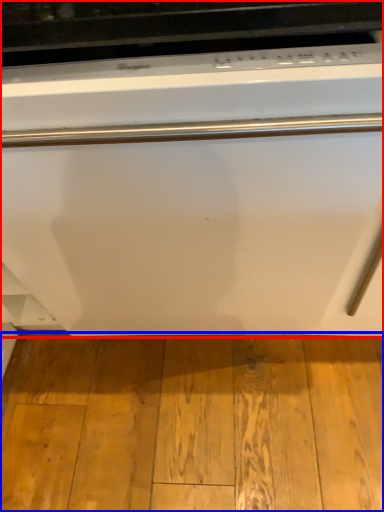
Question: Which object is closer to the camera taking this photo, home appliance (highlighted by a red box) or hardwood (highlighted by a blue box)?

Choices:
 (A) home appliance
 (B) hardwood

Answer: (A)